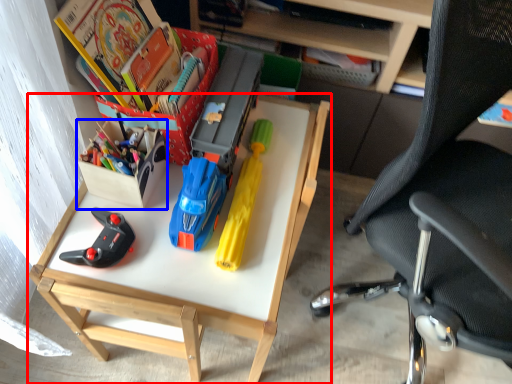
Question: Among these objects, which one is farthest to the camera, desk (highlighted by a red box) or kit (highlighted by a blue box)?

Choices:
 (A) desk
 (B) kit

Answer: (B)